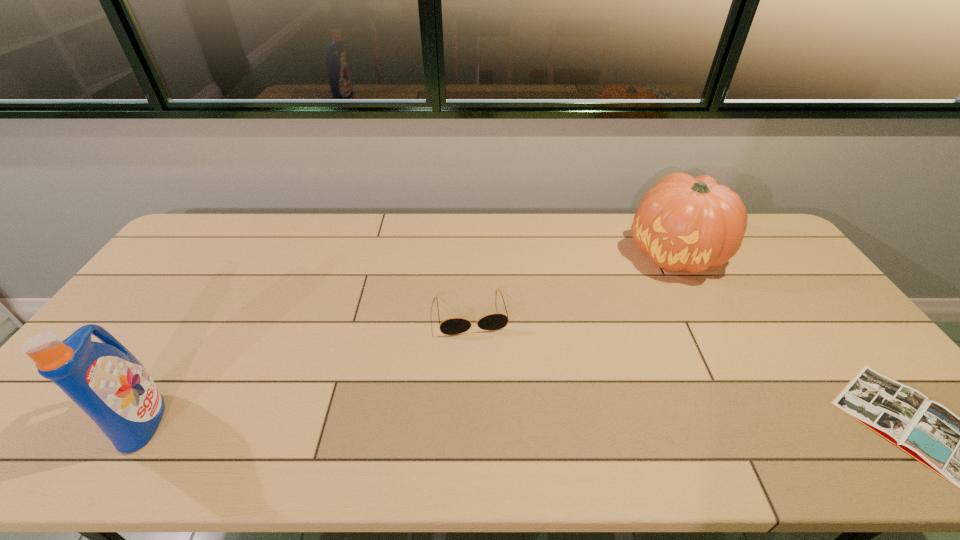
The height and width of the screenshot is (540, 960). I want to click on vacant area situated 0.230m on the carved face of the pumpkin, so click(x=635, y=327).

Image resolution: width=960 pixels, height=540 pixels. Find the location of `vacant region located on the carved face of the pumpkin`. vacant region located on the carved face of the pumpkin is located at coordinates (614, 362).

At what (x,y) coordinates should I click in order to perform the action: click on vacant space located 0.380m on the carved face of the pumpkin. Please return your answer as a coordinate pair (x, y). The width and height of the screenshot is (960, 540). Looking at the image, I should click on (614, 362).

The height and width of the screenshot is (540, 960). I want to click on object situated at the far edge, so click(x=683, y=223).

Find the location of a particular element. The height and width of the screenshot is (540, 960). object that is positioned at the near edge is located at coordinates (105, 380).

In the image, there is a desktop. At what (x,y) coordinates should I click in order to perform the action: click on free space at the far edge. Please return your answer as a coordinate pair (x, y). The width and height of the screenshot is (960, 540). Looking at the image, I should click on (402, 252).

In order to click on vacant space at the near edge of the desktop in this screenshot , I will do `click(682, 389)`.

Image resolution: width=960 pixels, height=540 pixels. Find the location of `free space at the left edge`. free space at the left edge is located at coordinates (136, 302).

Locate an element on the screen. The height and width of the screenshot is (540, 960). free location at the right edge of the desktop is located at coordinates (791, 316).

The height and width of the screenshot is (540, 960). Find the location of `vacant space in between the farthest object and the leftmost object`. vacant space in between the farthest object and the leftmost object is located at coordinates (409, 336).